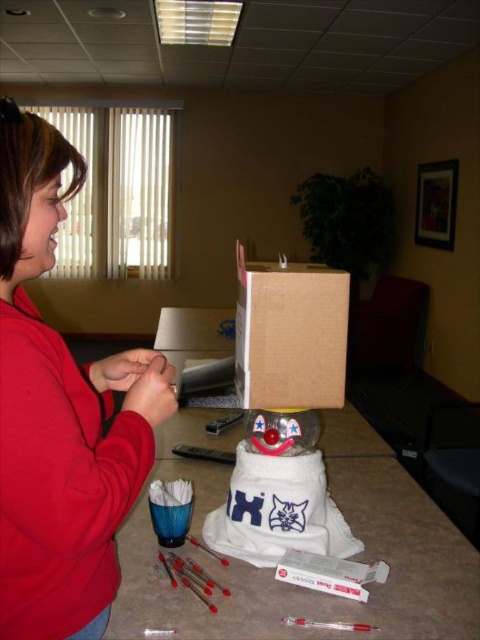
Can you confirm if translucent plastic table at center is wider than translucent plastic snowman at center?

Yes, translucent plastic table at center is wider than translucent plastic snowman at center.

Is translucent plastic table at center to the right of translucent plastic snowman at center from the viewer's perspective?

In fact, translucent plastic table at center is to the left of translucent plastic snowman at center.

Between point (420, 564) and point (302, 474), which one is positioned in front?

Point (302, 474) is in front.

Where is `translucent plastic table at center`? This screenshot has height=640, width=480. translucent plastic table at center is located at coordinates (352, 557).

From the picture: Does red fleece sweatshirt at left have a greater height compared to brown cardboard box at center?

Yes.

Between point (156, 422) and point (324, 337), which one is positioned behind?

Positioned behind is point (324, 337).

Find the location of a particular element. Image resolution: width=480 pixels, height=640 pixels. red fleece sweatshirt at left is located at coordinates (60, 413).

Is translucent plastic table at center thinner than brown cardboard box at center?

No.

The height and width of the screenshot is (640, 480). Find the location of `translucent plastic table at center`. translucent plastic table at center is located at coordinates (352, 557).

This screenshot has width=480, height=640. What do you see at coordinates (352, 557) in the screenshot?
I see `translucent plastic table at center` at bounding box center [352, 557].

You are a GUI agent. You are given a task and a screenshot of the screen. Output one action in this format:
    pyautogui.click(x=<x>, y=<y>)
    Task: Click on the translucent plastic table at center
    The height and width of the screenshot is (640, 480).
    Given the screenshot: What is the action you would take?
    pyautogui.click(x=352, y=557)